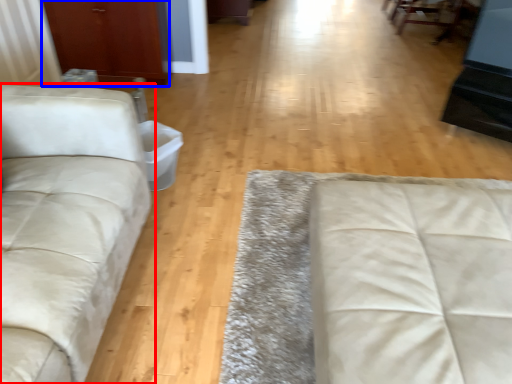
Question: Which object appears closest to the camera in this image, studio couch (highlighted by a red box) or armoire (highlighted by a blue box)?

Choices:
 (A) studio couch
 (B) armoire

Answer: (A)